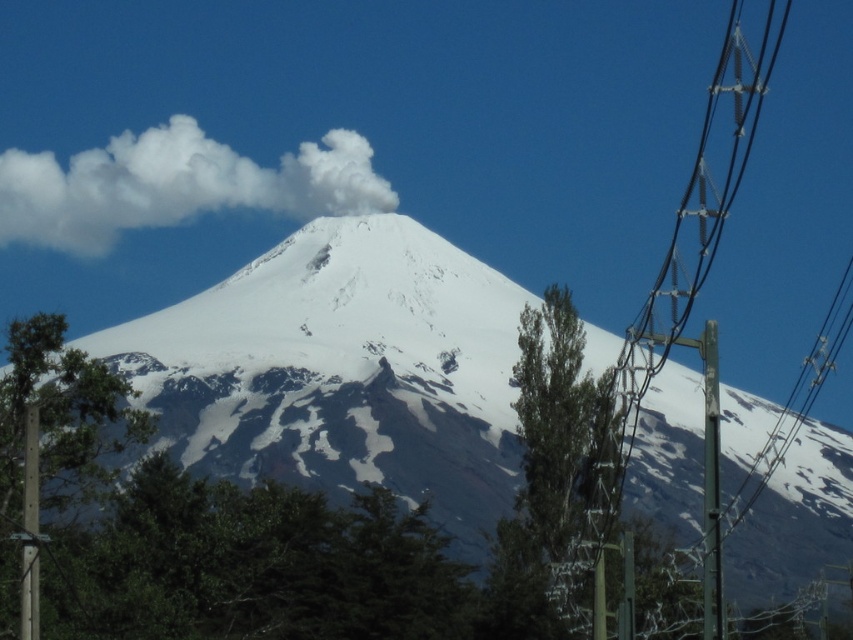
Question: Does metallic silver power line at right have a lesser width compared to wooden post at left?

Choices:
 (A) no
 (B) yes

Answer: (A)

Question: In this image, where is white snow-covered mountain at center located relative to metallic silver power line at right?

Choices:
 (A) left
 (B) right

Answer: (A)

Question: Which object is the farthest from the metallic silver power line at right?

Choices:
 (A) wooden post at left
 (B) white fluffy cloud at upper center
 (C) green metallic pole at right

Answer: (B)

Question: Which object is closer to the camera taking this photo?

Choices:
 (A) green metallic pole at right
 (B) white fluffy cloud at upper center
 (C) wooden post at left

Answer: (C)

Question: Which point is closer to the camera?

Choices:
 (A) metallic silver power line at right
 (B) green metallic pole at right
 (C) white fluffy cloud at upper center

Answer: (B)

Question: Is metallic silver power line at right positioned in front of wooden post at left?

Choices:
 (A) no
 (B) yes

Answer: (A)